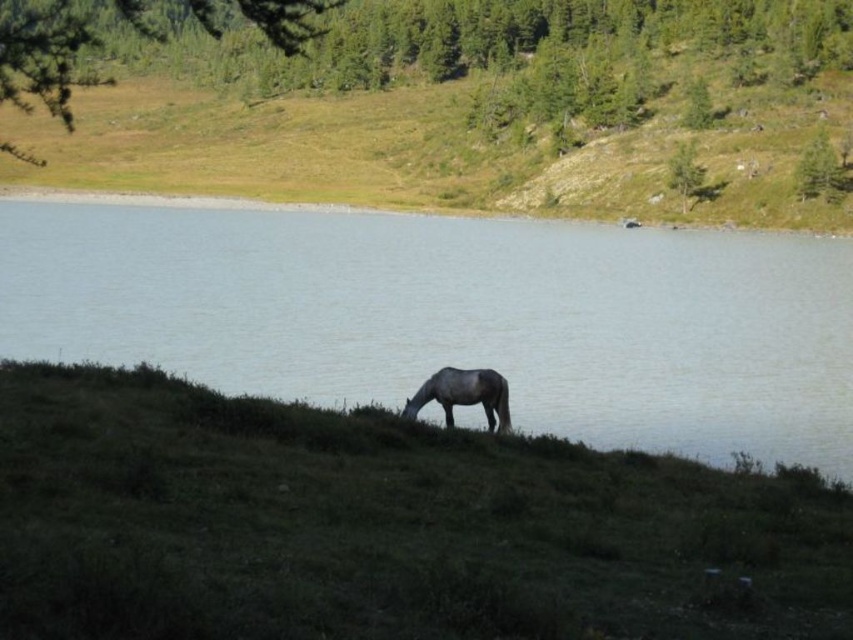
Question: Which object is the farthest from the clear water at center?

Choices:
 (A) green grassy hillside at center
 (B) gray matte horse at lower center
 (C) green grassy at lower center

Answer: (A)

Question: Is green grassy at lower center to the left of gray matte horse at lower center from the viewer's perspective?

Choices:
 (A) yes
 (B) no

Answer: (A)

Question: Which object appears farthest from the camera in this image?

Choices:
 (A) green grassy hillside at center
 (B) green grassy at lower center

Answer: (A)

Question: Is clear water at center to the left of gray matte horse at lower center from the viewer's perspective?

Choices:
 (A) yes
 (B) no

Answer: (A)

Question: Observing the image, what is the correct spatial positioning of green grassy at lower center in reference to green grassy hillside at center?

Choices:
 (A) right
 (B) left

Answer: (A)

Question: Based on their relative distances, which object is nearer to the clear water at center?

Choices:
 (A) green grassy at lower center
 (B) gray matte horse at lower center

Answer: (B)